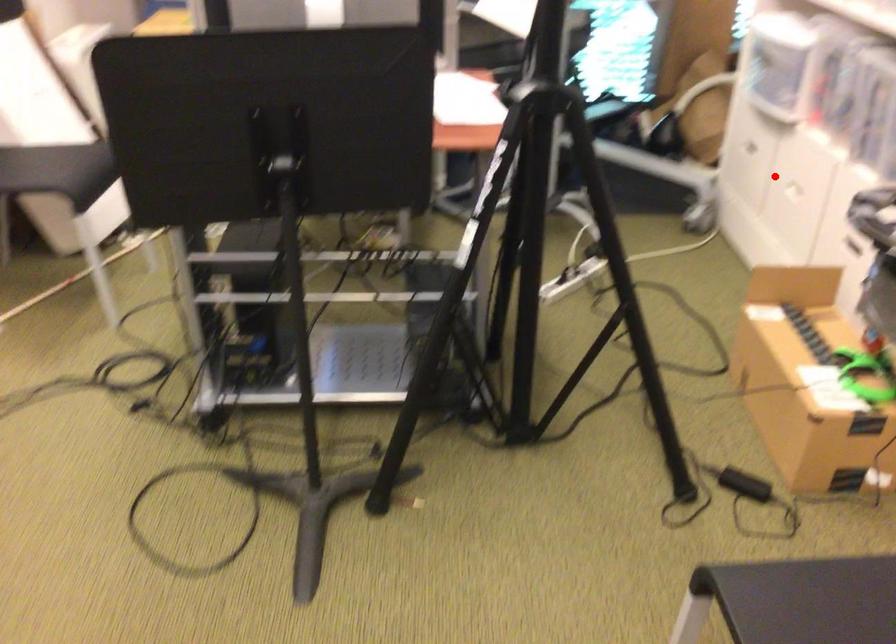
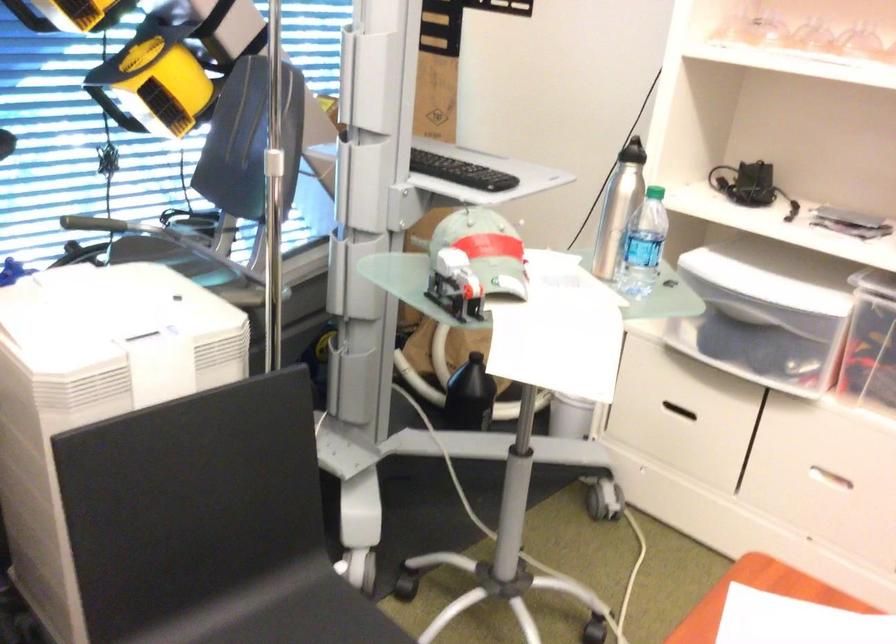
Find the pixel in the second image that matches the highlighted location in the first image.

(832, 478)